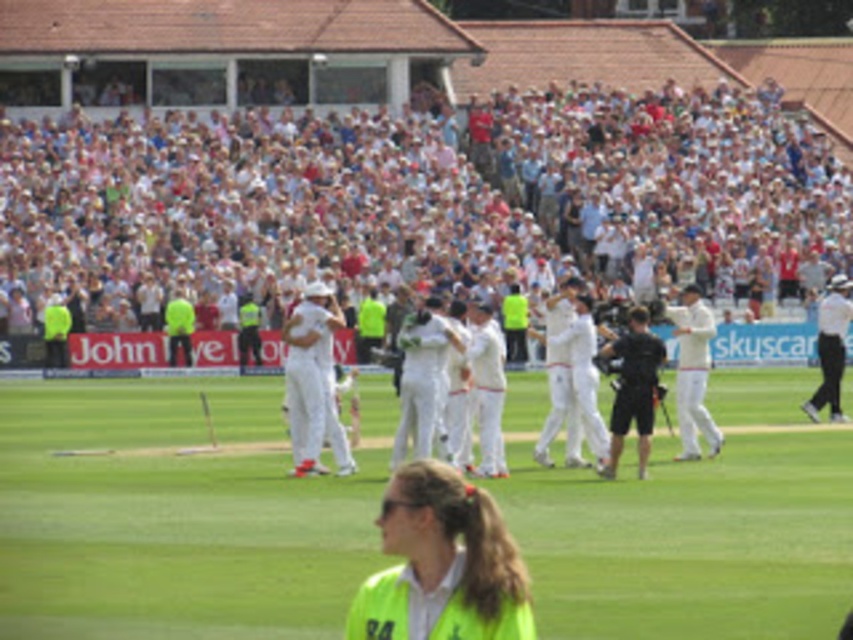
You are a photographer positioned at the edge of the cricket field. You want to take a photo that includes both the yellow reflective vest at lower center and the white clothed cricketer at center. Which object should you focus on first to ensure both are in clear view?

You should focus on the yellow reflective vest at lower center first because it is closer to the viewer than the white clothed cricketer at center, ensuring both are in clear focus when using depth of field appropriately.

In the scene shown: In the cricket match scene, there is a white clothed cricketer at center and a black matte camera at center. Which one is positioned to the left?

The white clothed cricketer at center is to the left of the black matte camera at center.